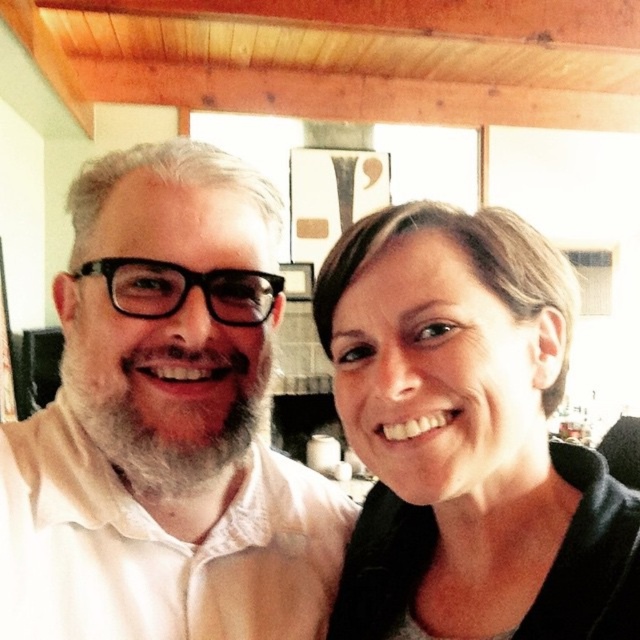
You are a photographer adjusting the lighting in the room. You notice the matte black hair at upper right and the white matte beard at left. Which object should you adjust the lighting for to ensure it is illuminated first?

The matte black hair at upper right should be adjusted first since it is closer to the viewer than the white matte beard at left, meaning it will receive light adjustments more immediately.

You are an interior designer assessing the lighting in the room. The matte black hair at upper right and white matte beard at left are both illuminated by the daylight. Given their height difference, which object might cast a longer shadow on the wooden ceiling beam?

The matte black hair at upper right has a greater height compared to the white matte beard at left, so it would cast a longer shadow on the wooden ceiling beam.

You are a photographer trying to frame a shot of the matte black hair at upper right and the white matte beard at left. Which of the two objects requires more horizontal space in the frame?

The matte black hair at upper right requires more horizontal space in the frame because its width is larger than the white matte beard at left.